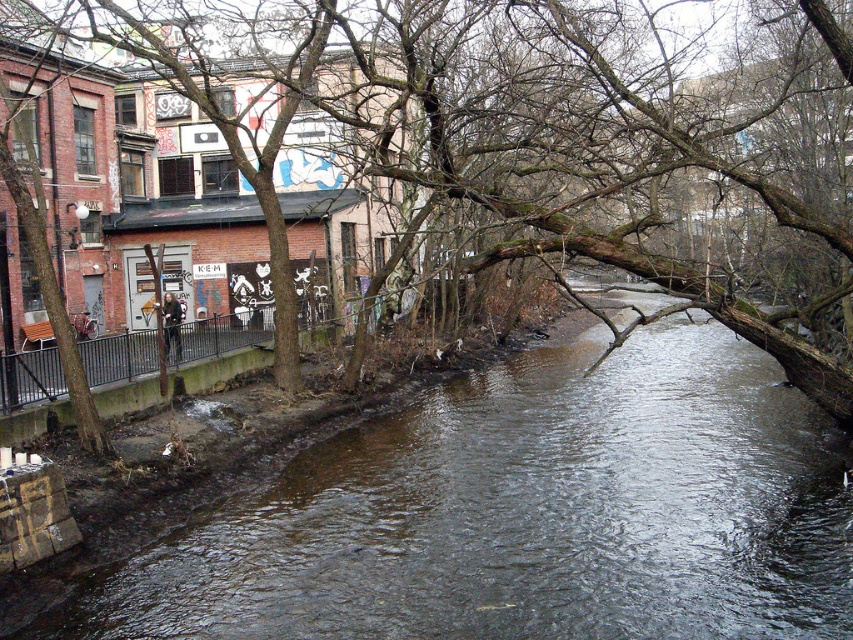
Which of these two, brown/rough concrete stream at center or brown rough tree trunk at center, stands taller?

Standing taller between the two is brown rough tree trunk at center.

Does brown/rough concrete stream at center have a greater width compared to brown rough tree trunk at center?

Incorrect, brown/rough concrete stream at center's width does not surpass brown rough tree trunk at center's.

Which is behind, point (674, 552) or point (665, 115)?

The point (665, 115) is more distant.

This screenshot has width=853, height=640. Identify the location of brown/rough concrete stream at center. (527, 513).